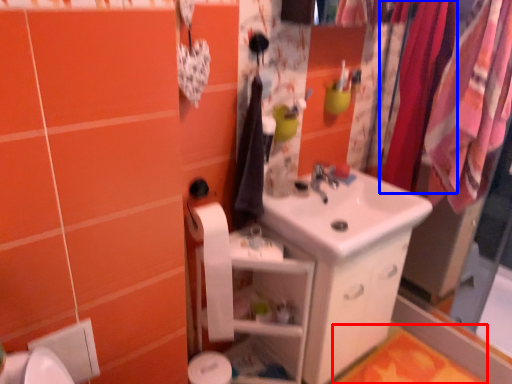
Question: Which point is further to the camera, bath mat (highlighted by a red box) or clothesline (highlighted by a blue box)?

Choices:
 (A) bath mat
 (B) clothesline

Answer: (A)